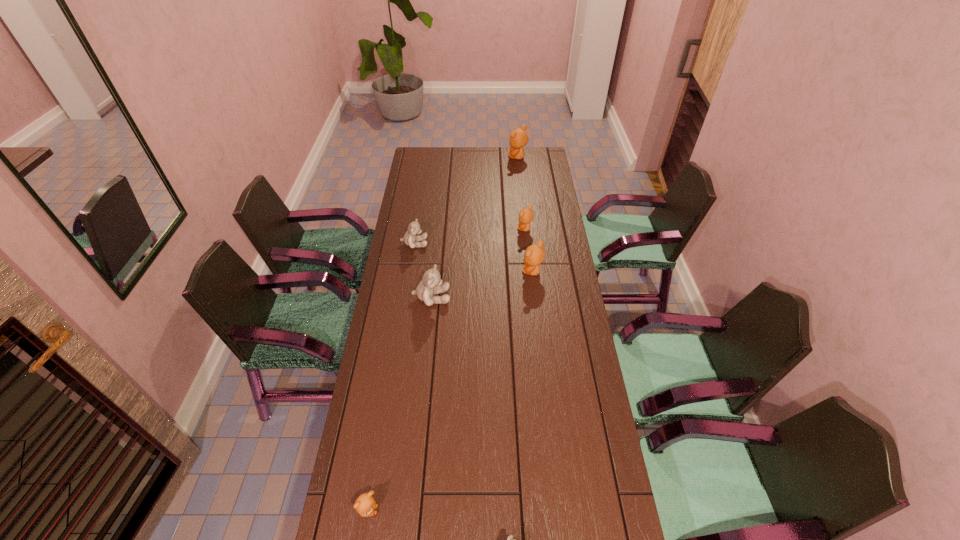
Locate an element on the screen. This screenshot has width=960, height=540. the second closest brown teddy bear to the nearest brown teddy bear is located at coordinates (526, 215).

The image size is (960, 540). I want to click on gray teddy bear that is the closest to the nearest brown teddy bear, so click(510, 539).

Locate an element on the screen. the second closest gray teddy bear to the second farthest brown teddy bear is located at coordinates (431, 284).